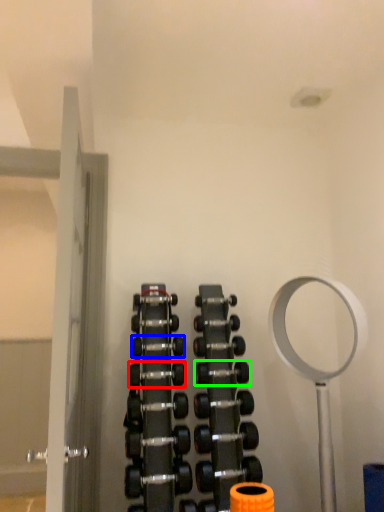
Question: Estimate the real-world distances between objects in this image. Which object is closer to dumbbell (highlighted by a red box), dumbbell (highlighted by a blue box) or dumbbell (highlighted by a green box)?

Choices:
 (A) dumbbell
 (B) dumbbell

Answer: (A)